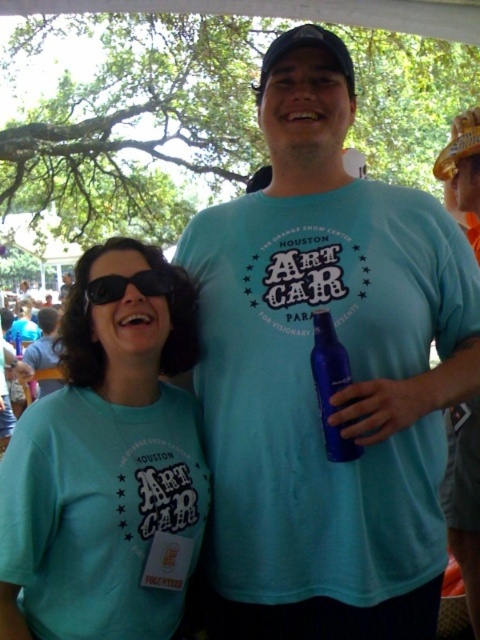
Question: Is matte teal shirt at center positioned at the back of black matte goggles at center?

Choices:
 (A) no
 (B) yes

Answer: (A)

Question: Among these objects, which one is nearest to the camera?

Choices:
 (A) light blue t-shirt at center
 (B) matte blue shirt at left

Answer: (A)

Question: Considering the real-world distances, which object is closest to the black matte goggles at center?

Choices:
 (A) matte blue shirt at left
 (B) light blue t-shirt at center
 (C) blue plastic bottle at center

Answer: (B)

Question: Is light blue t-shirt at center positioned behind matte blue shirt at left?

Choices:
 (A) no
 (B) yes

Answer: (A)

Question: Is matte teal shirt at center positioned before matte blue shirt at left?

Choices:
 (A) no
 (B) yes

Answer: (B)

Question: Estimate the real-world distances between objects in this image. Which object is closer to the matte teal shirt at center?

Choices:
 (A) black matte goggles at center
 (B) matte blue shirt at left

Answer: (A)